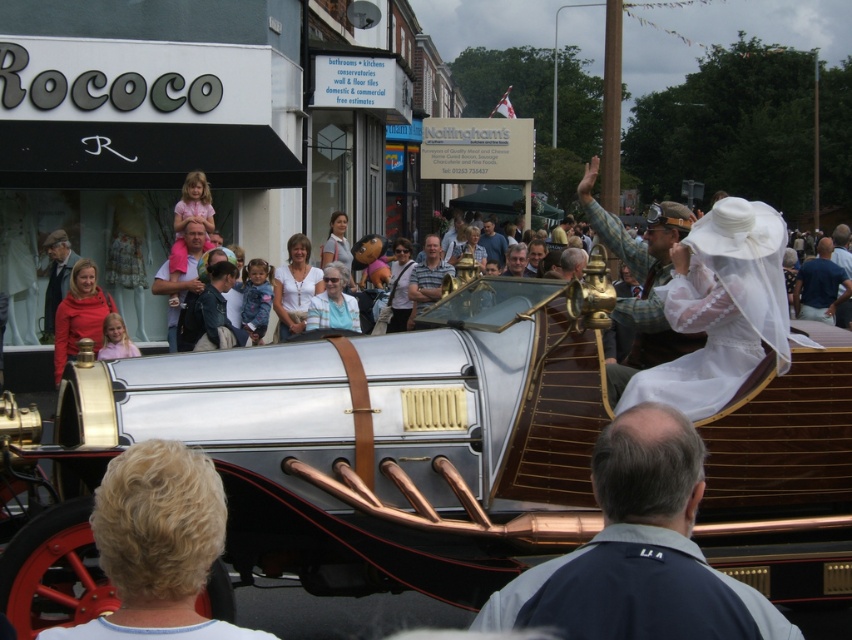
Does camouflage fabric hat at upper center appear on the left side of gray striped shirt at center?

In fact, camouflage fabric hat at upper center is to the right of gray striped shirt at center.

Who is shorter, camouflage fabric hat at upper center or gray striped shirt at center?

Standing shorter between the two is gray striped shirt at center.

Between point (619, 314) and point (453, 273), which one is positioned in front?

Point (619, 314) is more forward.

What are the coordinates of `camouflage fabric hat at upper center` in the screenshot? It's located at (635, 260).

Is polished silver car at center smaller than gray striped shirt at center?

Actually, polished silver car at center might be larger than gray striped shirt at center.

At what (x,y) coordinates should I click in order to perform the action: click on polished silver car at center. Please return your answer as a coordinate pair (x, y). The height and width of the screenshot is (640, 852). Looking at the image, I should click on (370, 440).

Who is more forward, (660, 204) or (850, 282)?

Point (850, 282) is more forward.

Which is below, camouflage fabric hat at upper center or light blue denim shirt at center?

light blue denim shirt at center is lower down.

Find the location of `camouflage fabric hat at upper center`. camouflage fabric hat at upper center is located at coordinates (635, 260).